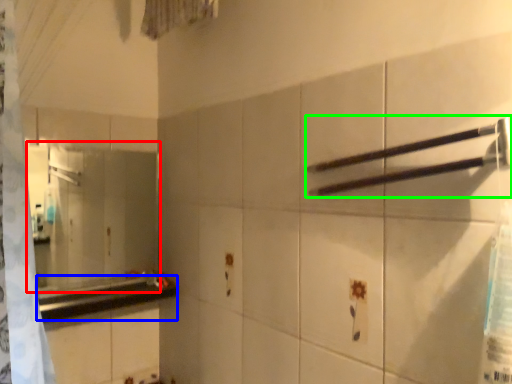
Question: Based on their relative distances, which object is farther from mirror (highlighted by a red box)? Choose from counter top (highlighted by a blue box) and towel bar (highlighted by a green box).

Choices:
 (A) counter top
 (B) towel bar

Answer: (B)